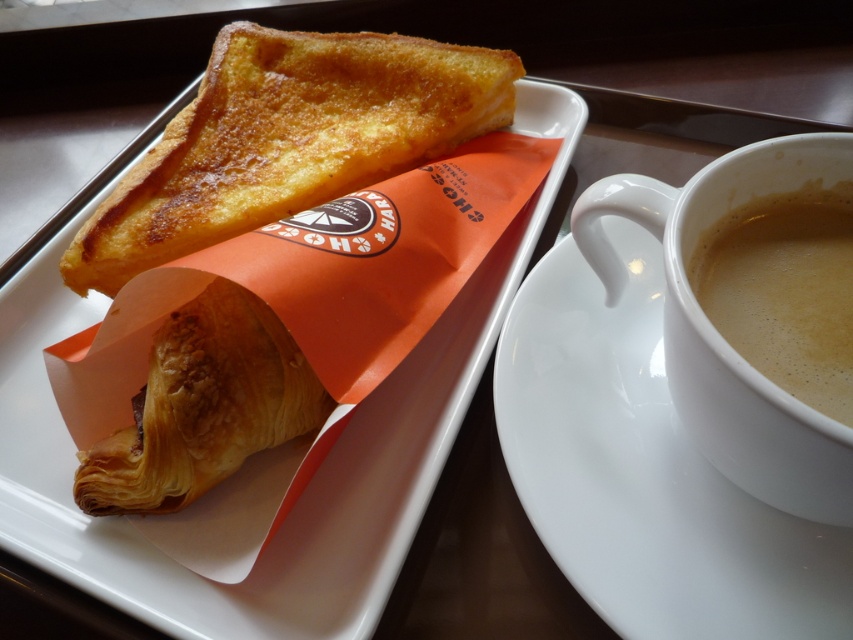
You are a food delivery person who needs to pack both the golden brown flaky croissant at upper left and the golden brown flaky croissant at lower left into a box that can only hold items up to 12 centimeters in width. The box is already partially filled with other items. If the narrower croissant is 10 centimeters wide, will both croissants fit in the box?

The golden brown flaky croissant at upper left is wider than the golden brown flaky croissant at lower left. Since the narrower croissant is 10 centimeters wide, the wider one must be larger than 10 centimeters. However, the box can only hold items up to 12 centimeters in width. Therefore, both croissants will fit as long as the wider croissant is less than or equal to 12 centimeters. But since we don not have the exact width of the wider croissant, we cannot confirm for sure. However, based on the given, 1

You are arranging a breakfast display and need to place both the golden brown flaky croissant at upper left and the golden brown flaky croissant at lower left on a shelf. According to the image, which croissant is placed higher on the table?

The golden brown flaky croissant at upper left is positioned higher on the table than the golden brown flaky croissant at lower left.

You are setting up a small breakfast display and need to stack items vertically. The matte white plate at upper left and the golden brown flaky croissant at lower left are part of this display. Which item should be placed at the bottom to ensure stability?

The matte white plate at upper left should be placed at the bottom since it has a greater height compared to the golden brown flaky croissant at lower left, providing a more stable base.